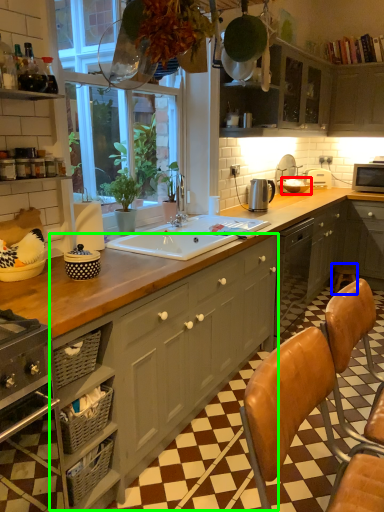
Question: Which object is positioned closest to appliance (highlighted by a red box)? Select from bar stool (highlighted by a blue box) and cabinetry (highlighted by a green box).

Choices:
 (A) bar stool
 (B) cabinetry

Answer: (A)